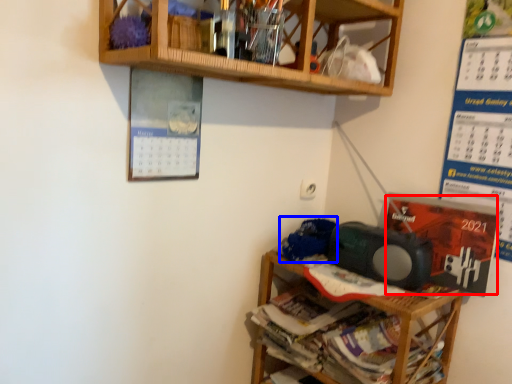
Question: Which object appears closest to the camera in this image, writing (highlighted by a red box) or waste (highlighted by a blue box)?

Choices:
 (A) writing
 (B) waste

Answer: (A)